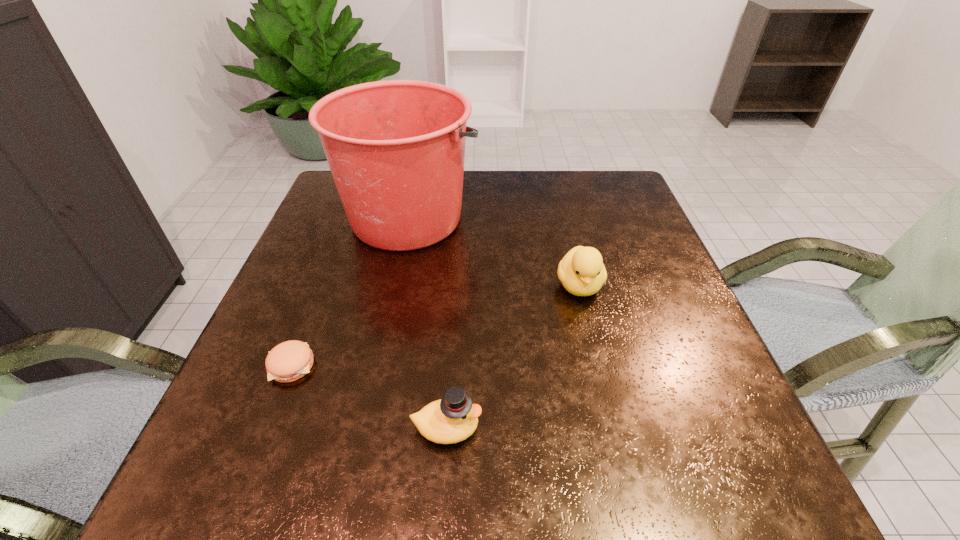
I want to click on the tallest object, so click(396, 148).

Locate an element on the screen. This screenshot has width=960, height=540. the farthest object is located at coordinates (396, 148).

The image size is (960, 540). I want to click on the rightmost object, so click(582, 272).

Locate an element on the screen. the third nearest object is located at coordinates pos(582,272).

At what (x,y) coordinates should I click in order to perform the action: click on the shorter duck. Please return your answer as a coordinate pair (x, y). This screenshot has height=540, width=960. Looking at the image, I should click on (454, 418).

Identify the location of the second shortest object. 454,418.

You are a GUI agent. You are given a task and a screenshot of the screen. Output one action in this format:
    pyautogui.click(x=<x>, y=<y>)
    Task: Click on the patty
    This screenshot has height=540, width=960.
    Given the screenshot: What is the action you would take?
    pyautogui.click(x=289, y=361)

In order to click on the shortest object in this screenshot , I will do `click(289, 361)`.

Where is `free space located 0.400m on the front of the bucket`? free space located 0.400m on the front of the bucket is located at coordinates (366, 426).

In order to click on vacant point located on the front-facing side of the right duck in this screenshot , I will do [x=635, y=512].